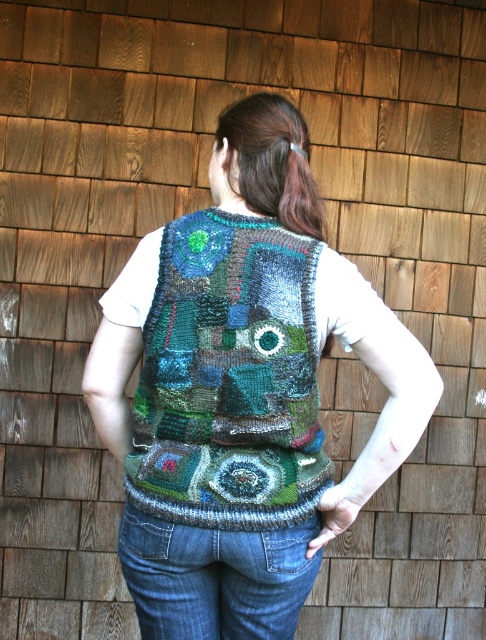
Is point (202, 570) positioned after point (222, 481)?

Yes.

In order to click on knitted vest at center in this screenshot , I will do `click(242, 392)`.

Does knitted multicolored vest at center have a lesser width compared to denim at lower center?

Correct, knitted multicolored vest at center's width is less than denim at lower center's.

From the picture: Can you confirm if knitted multicolored vest at center is positioned to the right of denim at lower center?

Correct, you'll find knitted multicolored vest at center to the right of denim at lower center.

Between point (314, 330) and point (275, 573), which one is positioned behind?

Positioned behind is point (275, 573).

In order to click on knitted multicolored vest at center in this screenshot , I will do `click(228, 378)`.

How far apart are knitted vest at center and denim at lower center?

knitted vest at center is 4.49 inches away from denim at lower center.

Between point (313, 364) and point (197, 634), which one is positioned in front?

Positioned in front is point (313, 364).

Is point (215, 332) positioned before point (132, 518)?

Yes, it is in front of point (132, 518).

Locate an element on the screen. knitted vest at center is located at coordinates (242, 392).